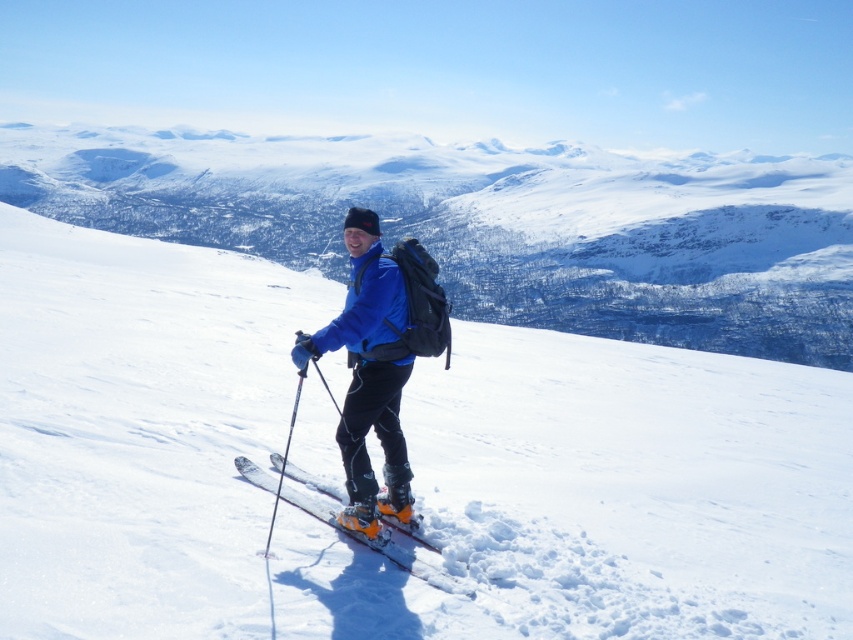
Does white powder snow at center have a lesser height compared to matte black ski pole at center?

No, white powder snow at center is not shorter than matte black ski pole at center.

Does white powder snow at center have a greater width compared to matte black ski pole at center?

Indeed, white powder snow at center has a greater width compared to matte black ski pole at center.

You are a GUI agent. You are given a task and a screenshot of the screen. Output one action in this format:
    pyautogui.click(x=<x>, y=<y>)
    Task: Click on the white powder snow at center
    Image resolution: width=853 pixels, height=640 pixels.
    Given the screenshot: What is the action you would take?
    pyautogui.click(x=601, y=499)

Which is more to the left, white snow mountain at center or orange matte skis at center?

white snow mountain at center is more to the left.

Identify the location of white snow mountain at center. The width and height of the screenshot is (853, 640). (494, 225).

Image resolution: width=853 pixels, height=640 pixels. In order to click on white snow mountain at center in this screenshot , I will do `click(494, 225)`.

Who is taller, orange matte skis at center or matte black ski pole at center?

Standing taller between the two is matte black ski pole at center.

Is orange matte skis at center shorter than matte black ski pole at center?

Indeed, orange matte skis at center has a lesser height compared to matte black ski pole at center.

Does point (299, 508) come in front of point (293, 406)?

Yes, point (299, 508) is in front of point (293, 406).

Identify the location of orange matte skis at center. The image size is (853, 640). (379, 545).